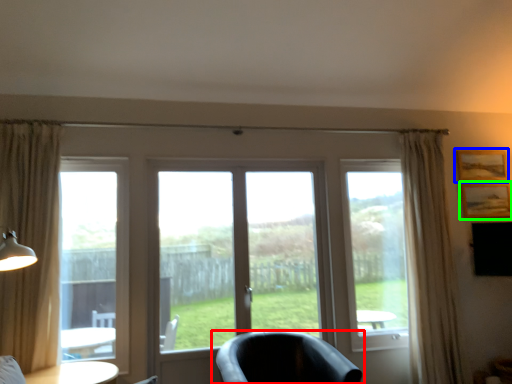
Question: Which object is the farthest from chair (highlighted by a red box)? Choose among these: picture frame (highlighted by a blue box) or picture frame (highlighted by a green box).

Choices:
 (A) picture frame
 (B) picture frame

Answer: (A)